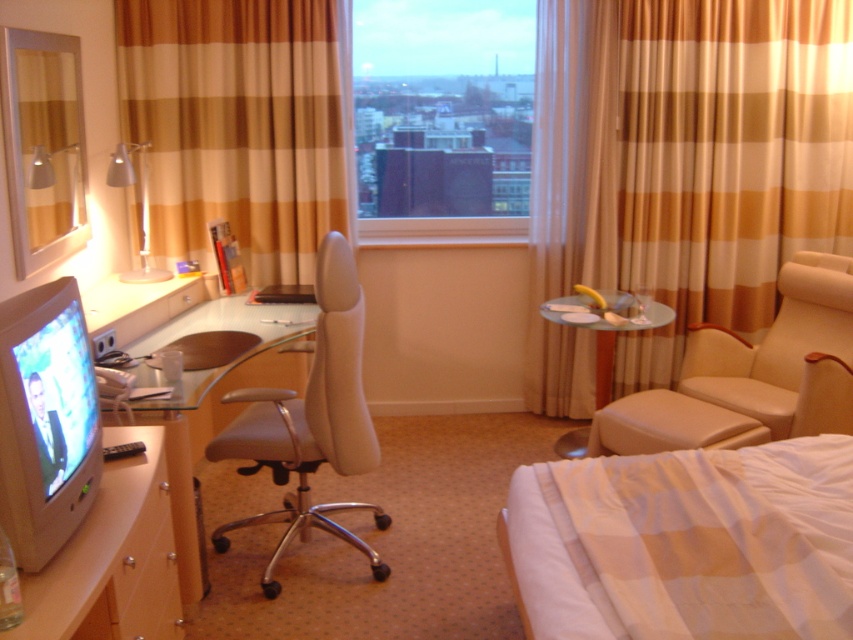
Question: Which object is farther from the camera taking this photo?

Choices:
 (A) matte gray monitor at lower left
 (B) matte white desk at center
 (C) transparent glass window at center
 (D) clear glass table at center

Answer: (C)

Question: Among these objects, which one is nearest to the camera?

Choices:
 (A) striped fabric curtain at right
 (B) matte white desk at center
 (C) brown striped curtain at upper center

Answer: (B)

Question: Observing the image, what is the correct spatial positioning of transparent glass window at center in reference to beige leather ottoman at lower right?

Choices:
 (A) above
 (B) below

Answer: (A)

Question: Estimate the real-world distances between objects in this image. Which object is closer to the beige striped curtain at right?

Choices:
 (A) brown striped curtain at upper center
 (B) beige leather ottoman at lower right
 (C) beige leather swivel chair at center
 (D) clear glass table at center

Answer: (D)

Question: From the image, what is the correct spatial relationship of transparent glass window at center in relation to clear glass table at center?

Choices:
 (A) below
 (B) above

Answer: (B)

Question: Observing the image, what is the correct spatial positioning of white checkered bed at lower right in reference to white glossy computer desk at lower left?

Choices:
 (A) right
 (B) left

Answer: (A)